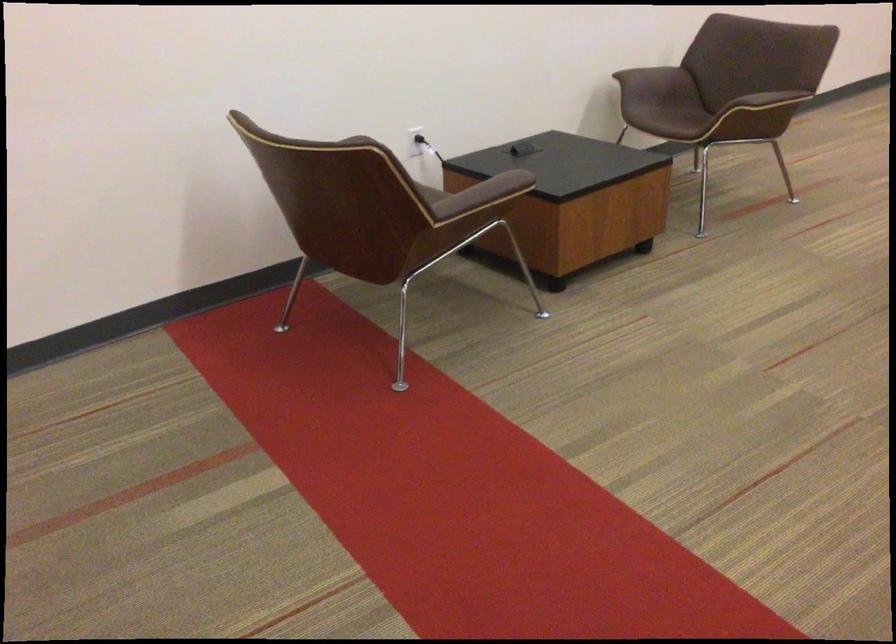
Where would you push the black power plug? Please return your answer as a coordinate pair (x, y).

(417, 140)